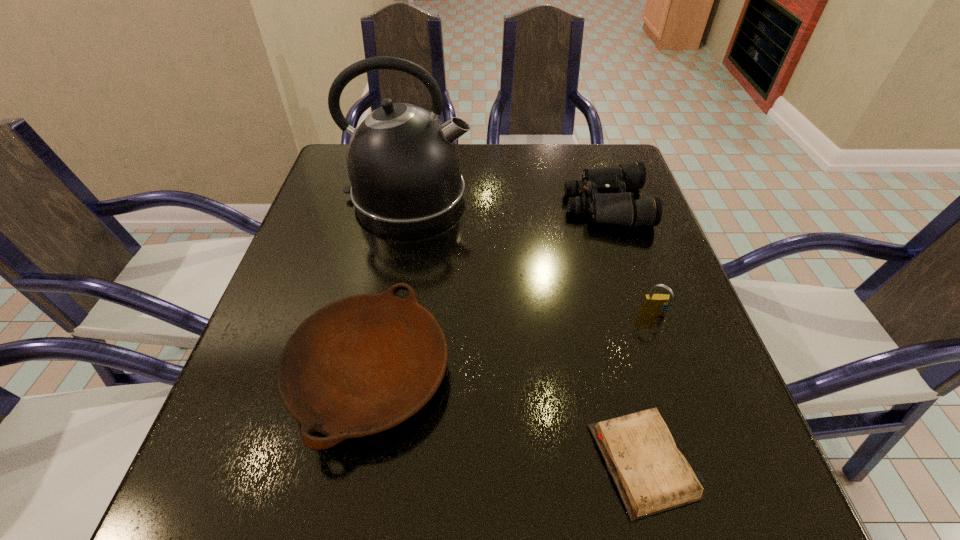
Identify the location of blank area located 0.210m through the eyepieces of the binoculars. The height and width of the screenshot is (540, 960). (478, 205).

Where is `free space located on the left of the diary`? The width and height of the screenshot is (960, 540). free space located on the left of the diary is located at coordinates [421, 461].

This screenshot has width=960, height=540. What are the coordinates of `kettle at the far edge` in the screenshot? It's located at (402, 161).

The width and height of the screenshot is (960, 540). What are the coordinates of `binoculars at the far edge` in the screenshot? It's located at (608, 202).

Find the location of a particular element. Image resolution: width=960 pixels, height=540 pixels. plate located in the near edge section of the desktop is located at coordinates (360, 365).

The height and width of the screenshot is (540, 960). Identify the location of diary present at the near edge. (652, 476).

Where is `kettle that is at the left edge`? kettle that is at the left edge is located at coordinates (402, 161).

Locate an element on the screen. Image resolution: width=960 pixels, height=540 pixels. plate that is at the left edge is located at coordinates (360, 365).

Image resolution: width=960 pixels, height=540 pixels. Identify the location of padlock that is at the right edge. (653, 304).

Where is `binoculars that is at the right edge`? binoculars that is at the right edge is located at coordinates (608, 202).